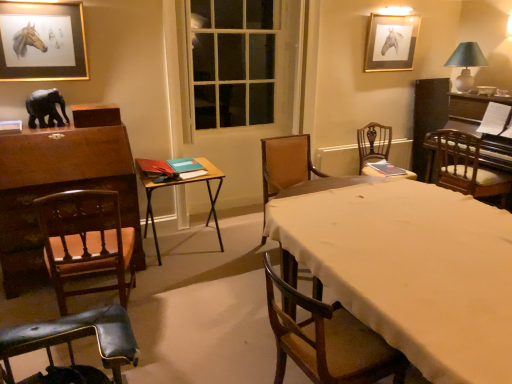
Question: From the image's perspective, is gold-framed picture at upper right, which is the second picture frame in left-to-right order, over gold-framed painting of horse at upper left, acting as the first picture frame starting from the front?

Choices:
 (A) no
 (B) yes

Answer: (B)

Question: From the image's perspective, is gold-framed picture at upper right, marked as the 1th picture frame in a back-to-front arrangement, under gold-framed painting of horse at upper left, positioned as the second picture frame in right-to-left order?

Choices:
 (A) no
 (B) yes

Answer: (A)

Question: From a real-world perspective, is gold-framed picture at upper right, which is the second picture frame in front-to-back order, below gold-framed painting of horse at upper left, acting as the first picture frame starting from the front?

Choices:
 (A) no
 (B) yes

Answer: (B)

Question: Is gold-framed picture at upper right, which is the second picture frame in left-to-right order, positioned before gold-framed painting of horse at upper left, which is the second picture frame in back-to-front order?

Choices:
 (A) yes
 (B) no

Answer: (B)

Question: Does gold-framed picture at upper right, marked as the 1th picture frame in a back-to-front arrangement, have a greater width compared to gold-framed painting of horse at upper left, which is the second picture frame in back-to-front order?

Choices:
 (A) no
 (B) yes

Answer: (A)

Question: Which is correct: leather cushioned chair at lower left, which is counted as the second chair, starting from the left, is inside green fabric lampshade at upper right, or outside of it?

Choices:
 (A) inside
 (B) outside

Answer: (B)

Question: Looking at their shapes, would you say leather cushioned chair at lower left, which appears as the 5th chair when viewed from the right, is wider or thinner than green fabric lampshade at upper right?

Choices:
 (A) thin
 (B) wide

Answer: (B)

Question: Does point (23, 382) appear closer or farther from the camera than point (471, 61)?

Choices:
 (A) closer
 (B) farther

Answer: (A)

Question: From the image's perspective, is leather cushioned chair at lower left, which is counted as the second chair, starting from the left, positioned above or below green fabric lampshade at upper right?

Choices:
 (A) below
 (B) above

Answer: (A)

Question: From the image's perspective, relative to wooden folding table at center, acting as the 1th table starting from the left, is brown fabric chair at center, the 4th chair positioned from the left, above or below?

Choices:
 (A) above
 (B) below

Answer: (A)

Question: Is brown fabric chair at center, the third chair viewed from the right, wider or thinner than wooden folding table at center, arranged as the second table when viewed from the right?

Choices:
 (A) thin
 (B) wide

Answer: (A)

Question: Considering the positions of brown fabric chair at center, the 4th chair positioned from the left, and wooden folding table at center, arranged as the second table when viewed from the right, in the image, is brown fabric chair at center, the 4th chair positioned from the left, bigger or smaller than wooden folding table at center, arranged as the second table when viewed from the right,?

Choices:
 (A) big
 (B) small

Answer: (A)

Question: Based on their positions, is brown fabric chair at center, the 4th chair positioned from the left, located to the left or right of wooden folding table at center, acting as the 1th table starting from the left?

Choices:
 (A) left
 (B) right

Answer: (B)

Question: Is wooden chair at center, the fourth chair in the right-to-left sequence, spatially inside black matte elephant at left, or outside of it?

Choices:
 (A) inside
 (B) outside

Answer: (B)

Question: Considering the positions of wooden chair at center, the 3th chair positioned from the left, and black matte elephant at left in the image, is wooden chair at center, the 3th chair positioned from the left, bigger or smaller than black matte elephant at left?

Choices:
 (A) big
 (B) small

Answer: (A)